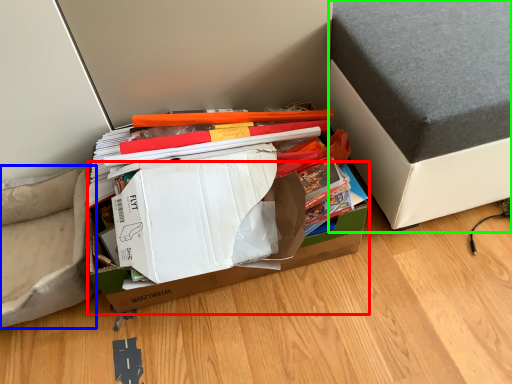
Question: Considering the real-world distances, which object is farthest from cardboard box (highlighted by a red box)? armchair (highlighted by a blue box) or furniture (highlighted by a green box)?

Choices:
 (A) armchair
 (B) furniture

Answer: (B)